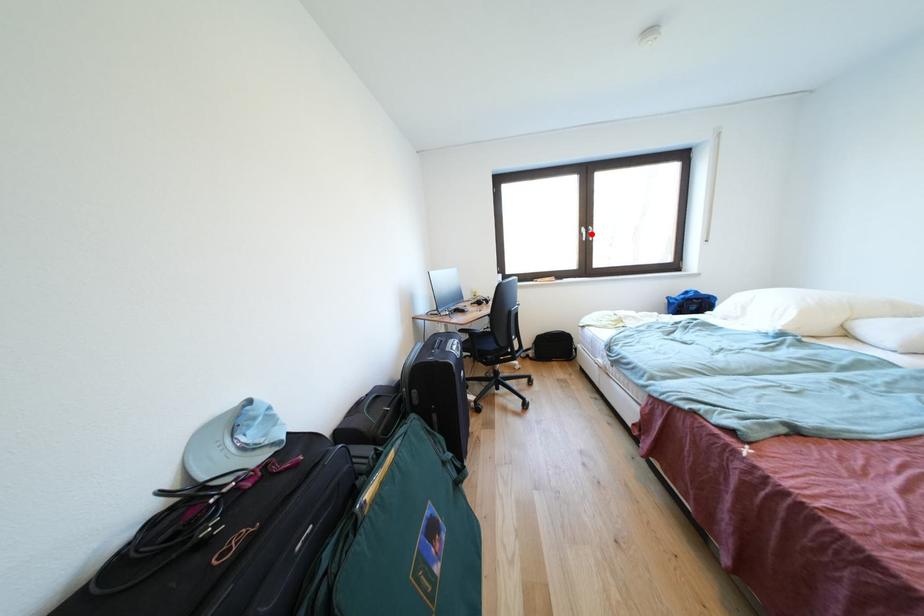
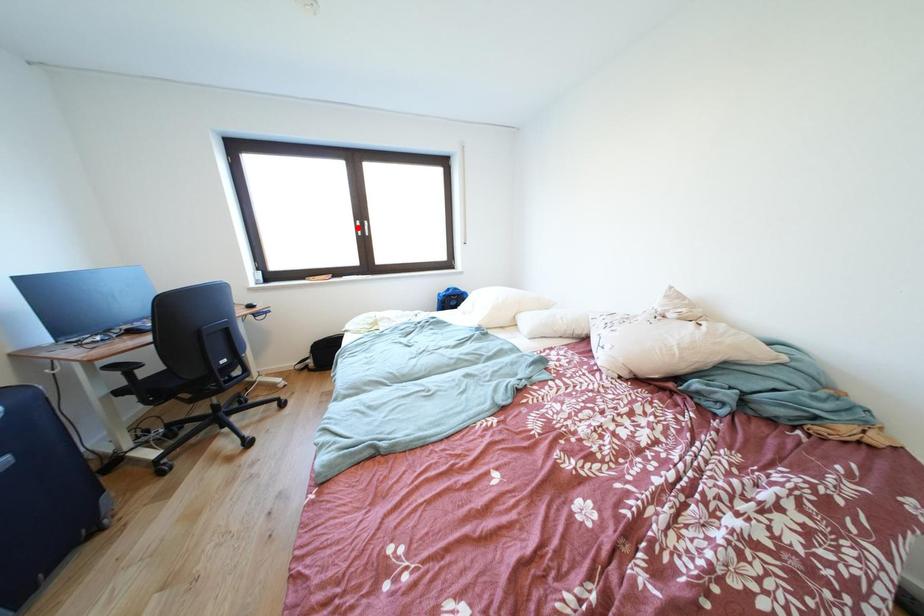
I am providing you with two images of the same scene from different viewpoints. A red point is marked on the first image and another point is marked on the second image. Are the points marked in image1 and image2 representing the same 3D position?

No